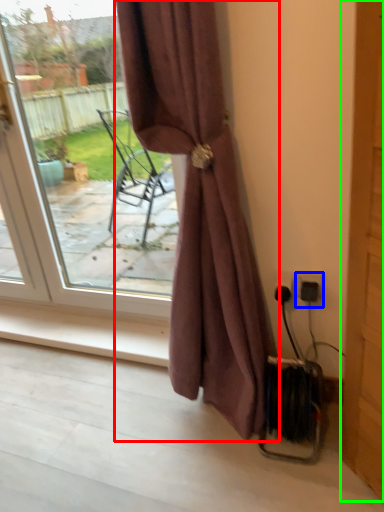
Question: Estimate the real-world distances between objects in this image. Which object is closer to curtain (highlighted by a red box), electric outlet (highlighted by a blue box) or screen door (highlighted by a green box)?

Choices:
 (A) electric outlet
 (B) screen door

Answer: (B)